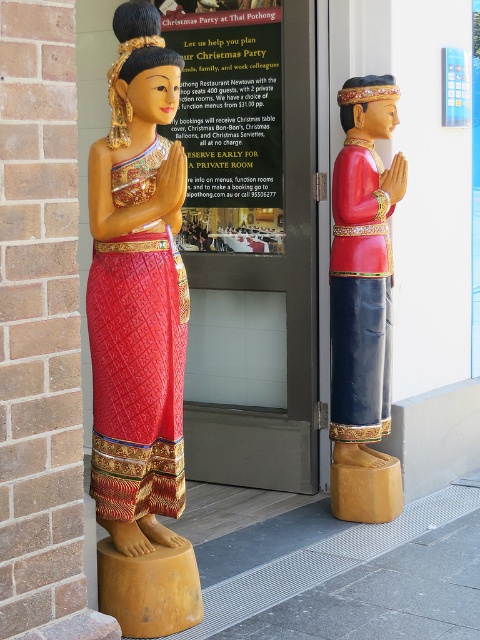
Can you confirm if wooden statue at left is bigger than wooden statue at right?

Indeed, wooden statue at left has a larger size compared to wooden statue at right.

Is wooden statue at left thinner than wooden statue at right?

Incorrect, wooden statue at left's width is not less than wooden statue at right's.

The height and width of the screenshot is (640, 480). What do you see at coordinates (137, 292) in the screenshot? I see `wooden statue at left` at bounding box center [137, 292].

This screenshot has height=640, width=480. I want to click on wooden statue at left, so click(x=137, y=292).